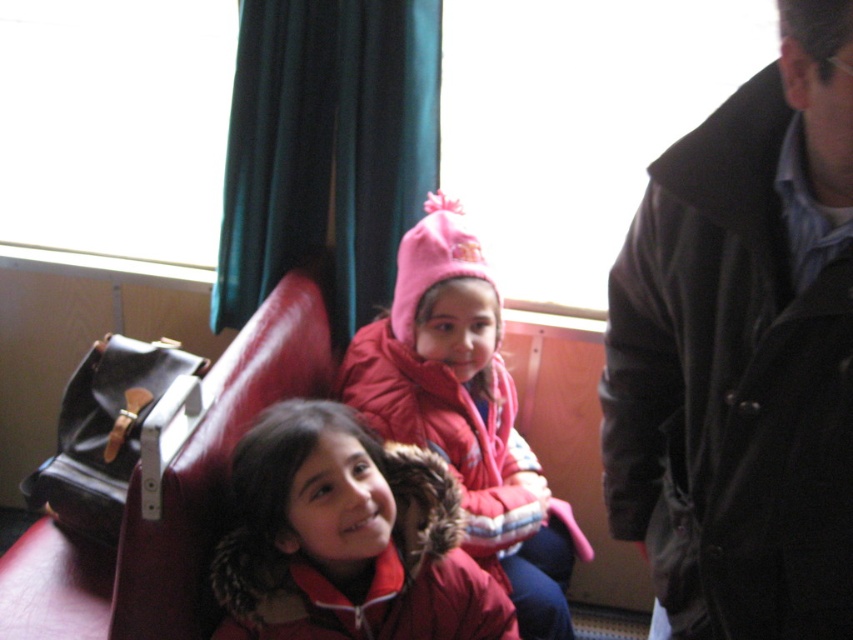
Can you confirm if black leather jacket at upper right is shorter than red fleece jacket at center?

In fact, black leather jacket at upper right may be taller than red fleece jacket at center.

Who is higher up, black leather jacket at upper right or red fleece jacket at center?

black leather jacket at upper right is above.

Locate an element on the screen. black leather jacket at upper right is located at coordinates (730, 388).

Is point (293, 445) less distant than point (374, 332)?

Yes, point (293, 445) is in front of point (374, 332).

Is fuzzy red jacket at center closer to camera compared to pink fleece hat at center?

Yes, fuzzy red jacket at center is closer to the viewer.

Where is `fuzzy red jacket at center`? This screenshot has width=853, height=640. fuzzy red jacket at center is located at coordinates (347, 538).

Is point (758, 236) less distant than point (352, 602)?

Yes.

Between black leather jacket at upper right and fuzzy red jacket at center, which one appears on the right side from the viewer's perspective?

black leather jacket at upper right

Is point (604, 408) positioned after point (341, 451)?

No, it is in front of (341, 451).

Where is `black leather jacket at upper right`? black leather jacket at upper right is located at coordinates (730, 388).